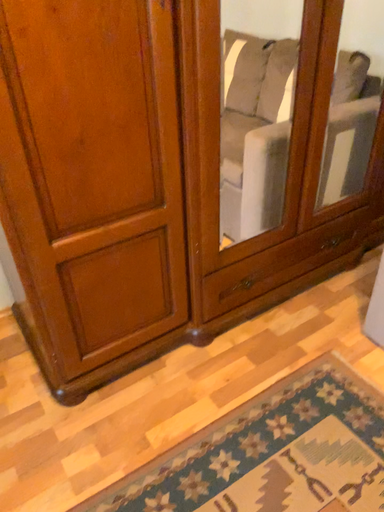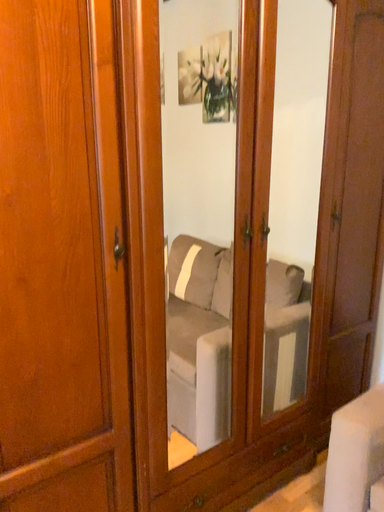
Question: How did the camera likely rotate when shooting the video?

Choices:
 (A) rotated upward
 (B) rotated downward

Answer: (A)